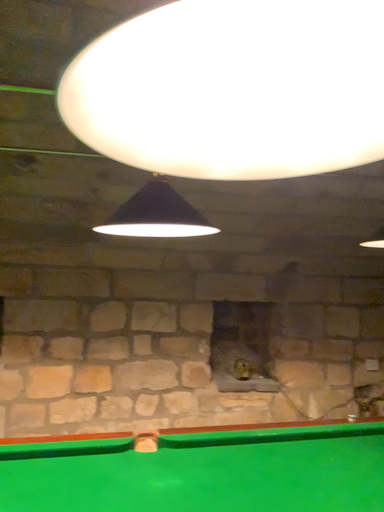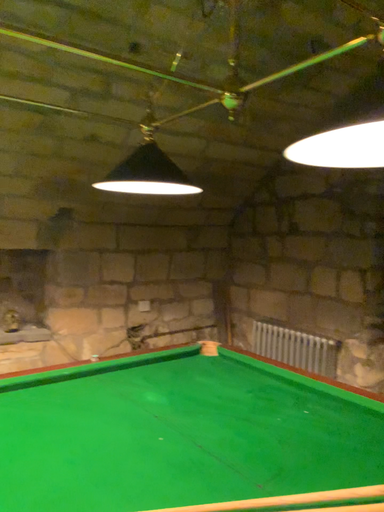
Question: Which way did the camera rotate in the video?

Choices:
 (A) rotated left
 (B) rotated right

Answer: (B)